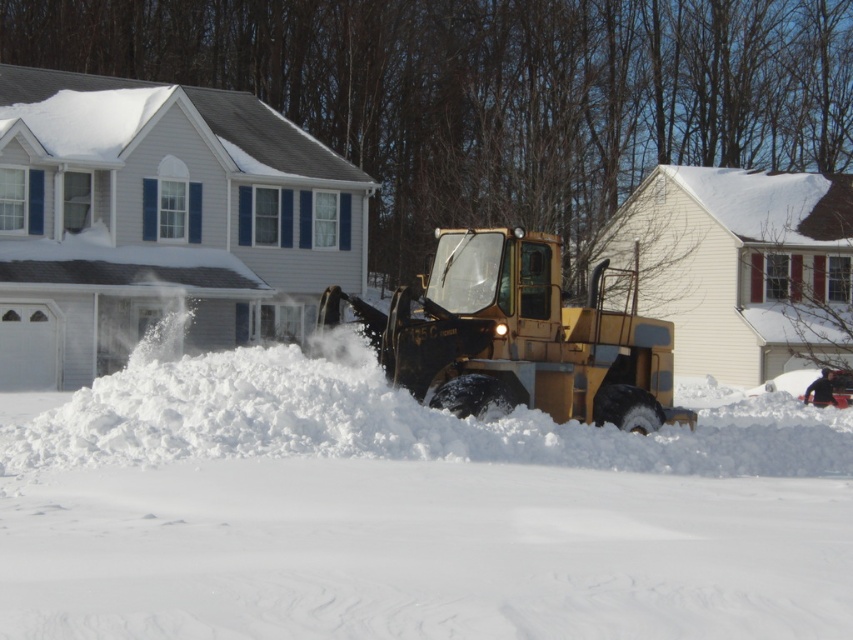
Question: Which point appears closest to the camera in this image?

Choices:
 (A) coord(688,460)
 (B) coord(445,282)

Answer: (A)

Question: Is white fluffy snow at center wider than metallic yellow tractor at center?

Choices:
 (A) yes
 (B) no

Answer: (A)

Question: Is white fluffy snow at center positioned at the back of metallic yellow tractor at center?

Choices:
 (A) no
 (B) yes

Answer: (A)

Question: Does white fluffy snow at center have a lesser width compared to metallic yellow tractor at center?

Choices:
 (A) yes
 (B) no

Answer: (B)